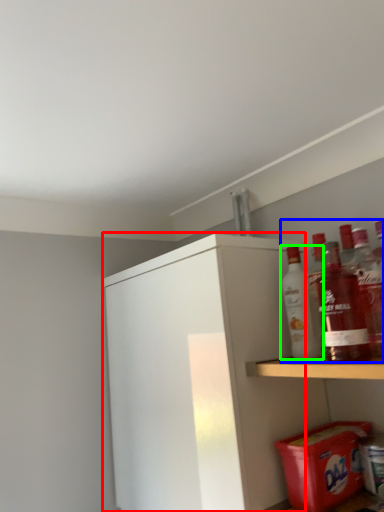
Question: Based on their relative distances, which object is nearer to cabinetry (highlighted by a red box)? Choose from beverage (highlighted by a blue box) and bottle (highlighted by a green box).

Choices:
 (A) beverage
 (B) bottle

Answer: (B)